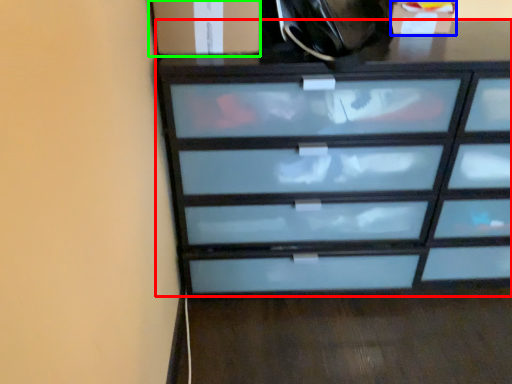
Question: Based on their relative distances, which object is nearer to chest of drawers (highlighted by a red box)? Choose from cabinetry (highlighted by a blue box) and cabinetry (highlighted by a green box).

Choices:
 (A) cabinetry
 (B) cabinetry

Answer: (B)